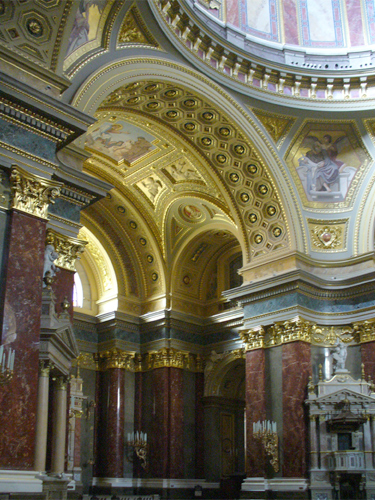
Identify the location of door. (229, 457).